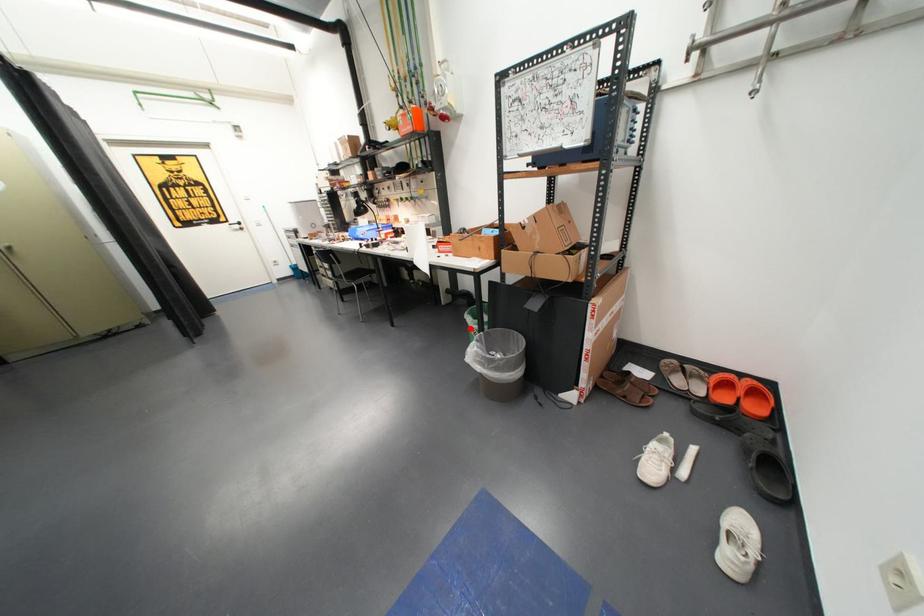
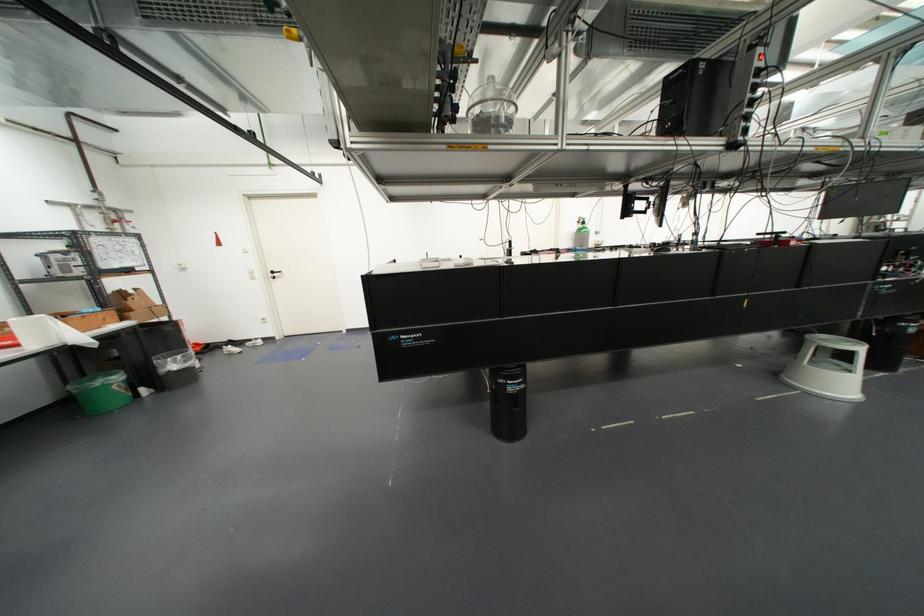
Locate, in the second image, the point that corresponds to the highlighted location in the first image.

(113, 387)